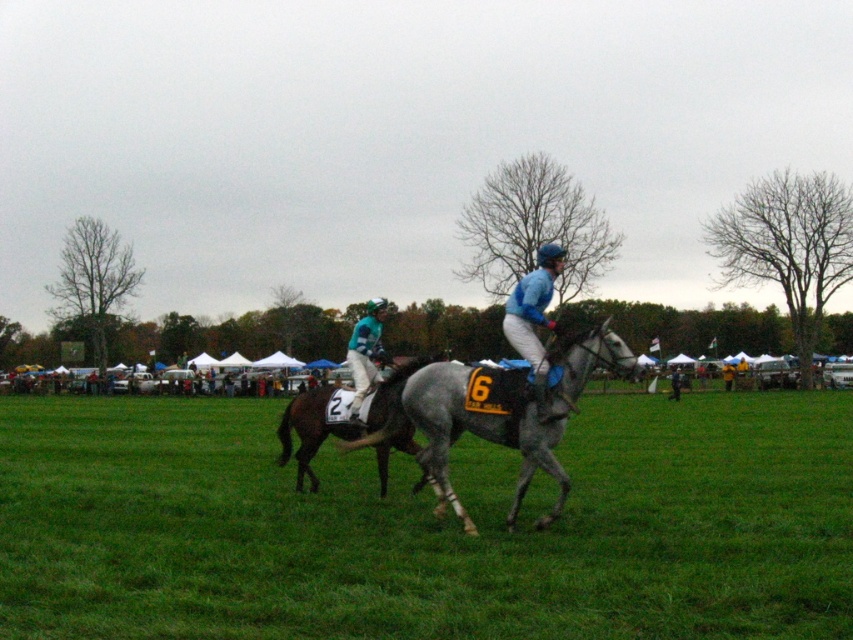
You are a spectator at the horse race and want to know which horse is shorter between the gray textured horse at center and the gray glossy horse at center. Can you tell me?

The gray textured horse at center has a lesser height compared to the gray glossy horse at center, so the gray textured horse at center is shorter.

You are a photographer trying to capture the leading horse in the horse racing scene. You notice two points marked in the image. The first point is at coordinates point (561, 346) and the second point is at point (375, 300). Which point is closer to the leading horse?

Point (561, 346) is closer to the leading horse because it is in front of point (375, 300).

You are a photographer at the horse race. You want to capture a photo of both the gray textured horse at center and the gray glossy horse at center. Which horse should you focus on first to ensure it appears larger in your photo?

You should focus on the gray textured horse at center first because it is bigger than the gray glossy horse at center, so it will appear larger in the photo.